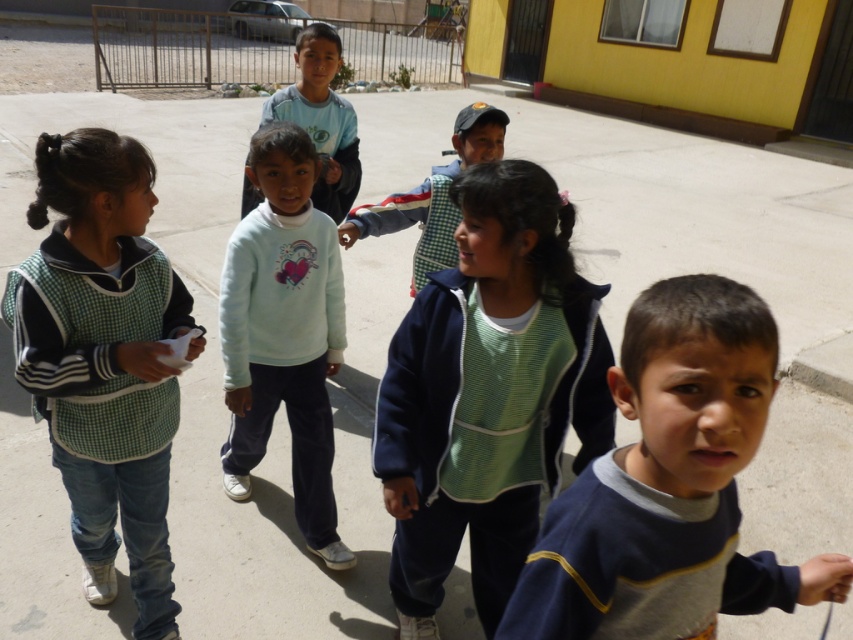
You are a photographer standing at the center of the paved area. You want to take a photo of the green knit sweater at center. Where should you aim your camera to capture it?

The green knit sweater at center is located at point 0.616 on the x axis and 0.573 on the y axis, so you should aim your camera towards those coordinates to capture it.

You are a photographer trying to capture both the green knit sweater at center and the green checkered vest at left in the same frame. Considering their sizes, which one should you focus on to ensure both are clearly visible in the photo?

The green knit sweater at center is smaller in size compared to the green checkered vest at left. To ensure both are clearly visible, focus on the green checkered vest at left as the primary subject and adjust the camera angle to include the smaller green knit sweater at center in the frame.